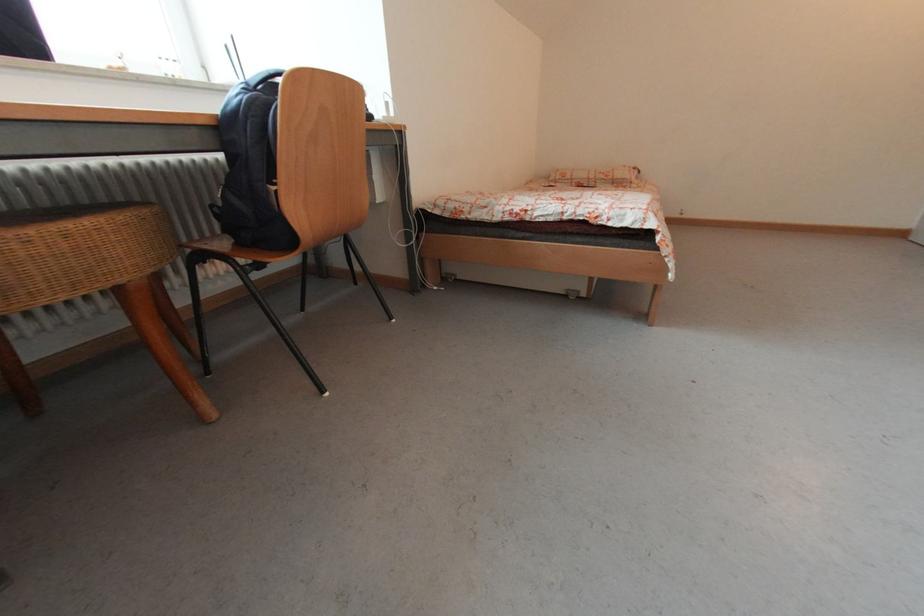
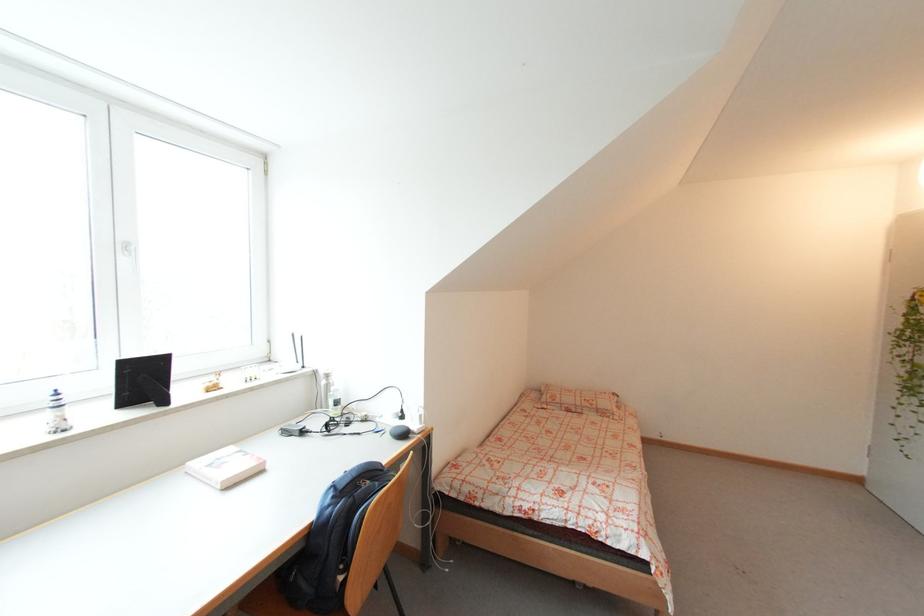
In the second image, find the point that corresponds to [565,180] in the first image.

(555, 405)